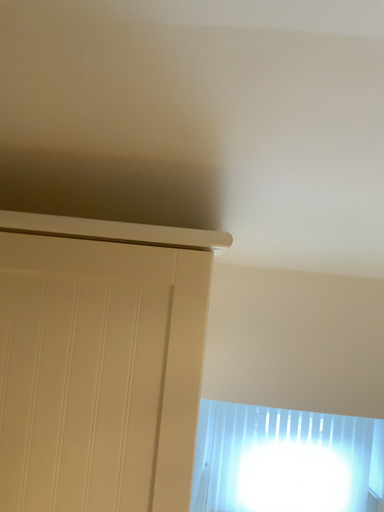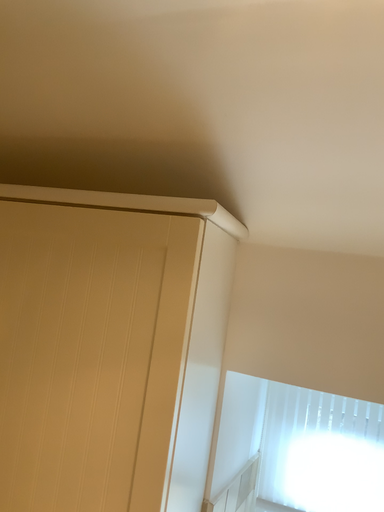
Question: Which way did the camera rotate in the video?

Choices:
 (A) rotated right
 (B) rotated left

Answer: (B)